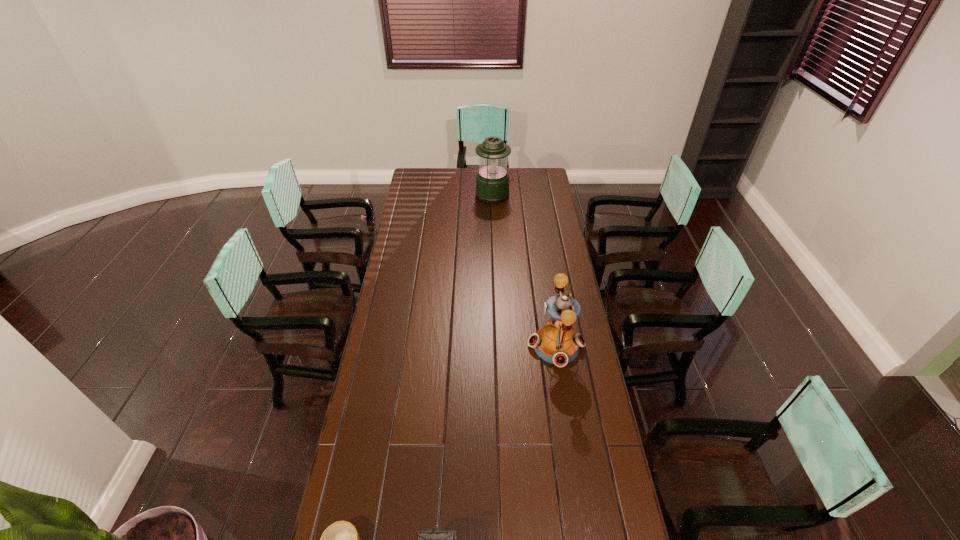
Image resolution: width=960 pixels, height=540 pixels. Find the location of `the farthest lantern`. the farthest lantern is located at coordinates (492, 180).

The image size is (960, 540). I want to click on the third nearest object, so click(556, 342).

Identify the location of the second farthest lantern. The image size is (960, 540). click(x=556, y=342).

Identify the location of free location located on the back of the farthest object. (493, 174).

Identify the location of free location located 0.050m on the front-facing side of the second farthest lantern. The image size is (960, 540). (516, 346).

Identify the location of vacant region located on the front-facing side of the second farthest lantern. The height and width of the screenshot is (540, 960). (501, 346).

Where is `free region located on the front-facing side of the second farthest lantern`? The image size is (960, 540). free region located on the front-facing side of the second farthest lantern is located at coordinates (486, 346).

At what (x,y) coordinates should I click in order to perform the action: click on object that is positioned at the far edge. Please return your answer as a coordinate pair (x, y). The height and width of the screenshot is (540, 960). Looking at the image, I should click on (492, 180).

Where is `object located in the right edge section of the desktop`? object located in the right edge section of the desktop is located at coordinates (556, 342).

Locate an element on the screen. The width and height of the screenshot is (960, 540). vacant space at the left edge of the desktop is located at coordinates (408, 233).